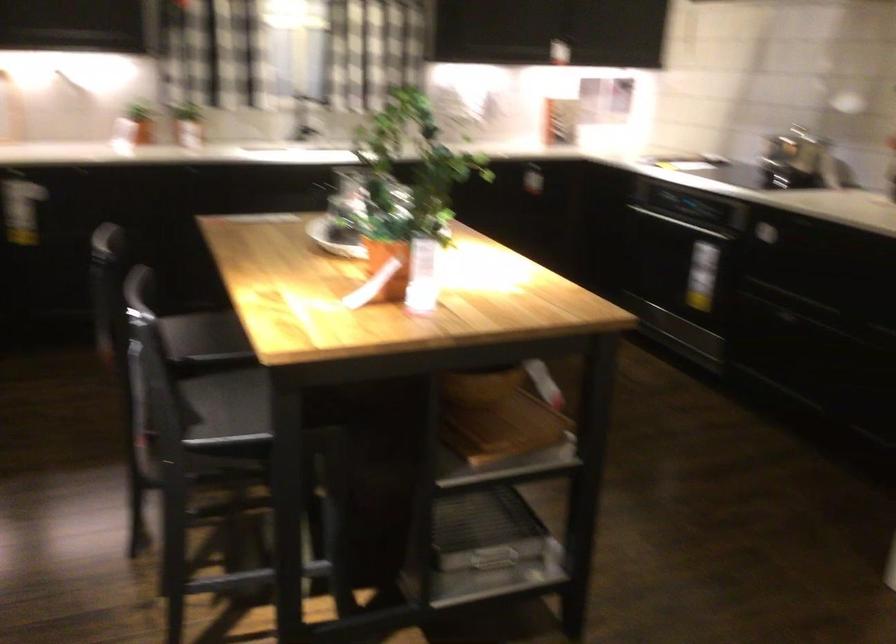
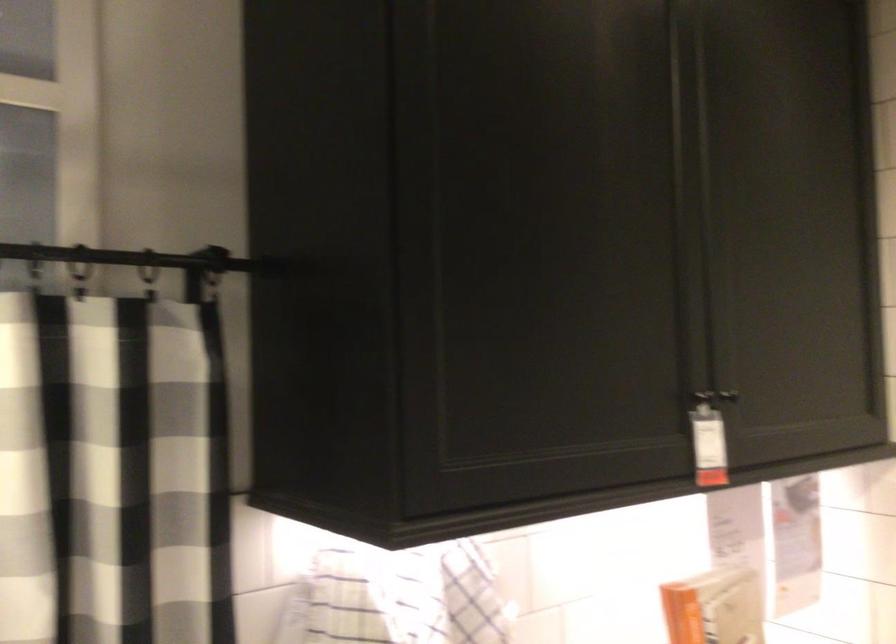
Question: What movement of the cameraman would produce the second image?

Choices:
 (A) Left
 (B) Right
 (C) Forward
 (D) Backward

Answer: (C)